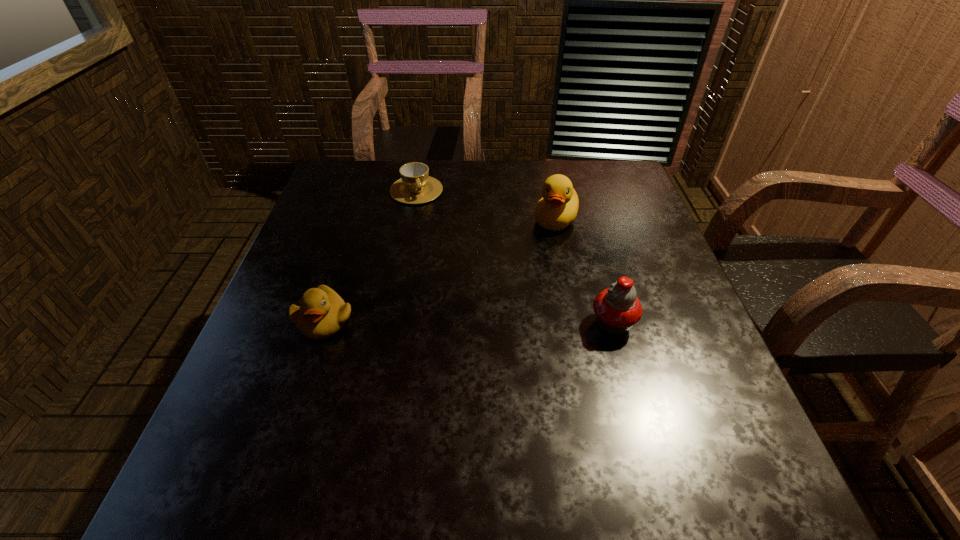
The width and height of the screenshot is (960, 540). I want to click on the leftmost object, so (x=322, y=313).

This screenshot has height=540, width=960. I want to click on duckling, so click(x=322, y=313).

Find the location of a particular element. cupcake is located at coordinates (617, 308).

Where is `cup`? cup is located at coordinates (416, 186).

Where is `the third object from right to left`? Image resolution: width=960 pixels, height=540 pixels. the third object from right to left is located at coordinates (416, 186).

Where is `duck`? This screenshot has width=960, height=540. duck is located at coordinates (558, 207).

Where is `free space located at the beak of the second shortest object`? The width and height of the screenshot is (960, 540). free space located at the beak of the second shortest object is located at coordinates (310, 364).

In order to click on vacant space located on the back of the cupcake in this screenshot , I will do click(x=594, y=257).

Locate an element on the screen. free space located 0.220m with the handle on the side of the second object from left to right is located at coordinates (443, 255).

At what (x,y) coordinates should I click in order to perform the action: click on free space located 0.260m with the handle on the side of the second object from left to right. Please return your answer as a coordinate pair (x, y). Looking at the image, I should click on click(447, 265).